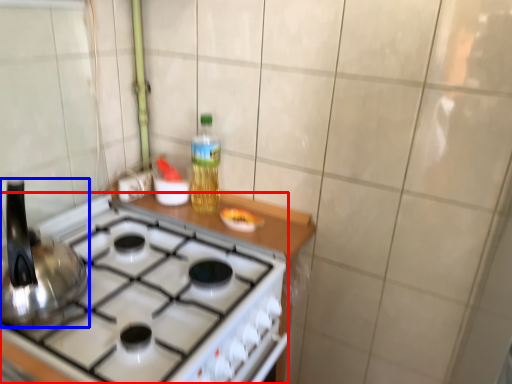
Question: Which object appears farthest to the camera in this image, gas stove (highlighted by a red box) or kitchen appliance (highlighted by a blue box)?

Choices:
 (A) gas stove
 (B) kitchen appliance

Answer: (A)